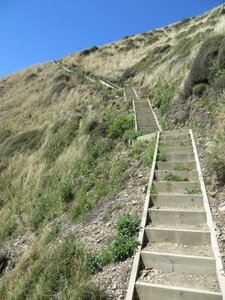
You are a GUI agent. You are given a task and a screenshot of the screen. Output one action in this format:
    pyautogui.click(x=<x>, y=<y>)
    Task: Click on the 1st stair
    
    Given the screenshot: What is the action you would take?
    pyautogui.click(x=188, y=289)